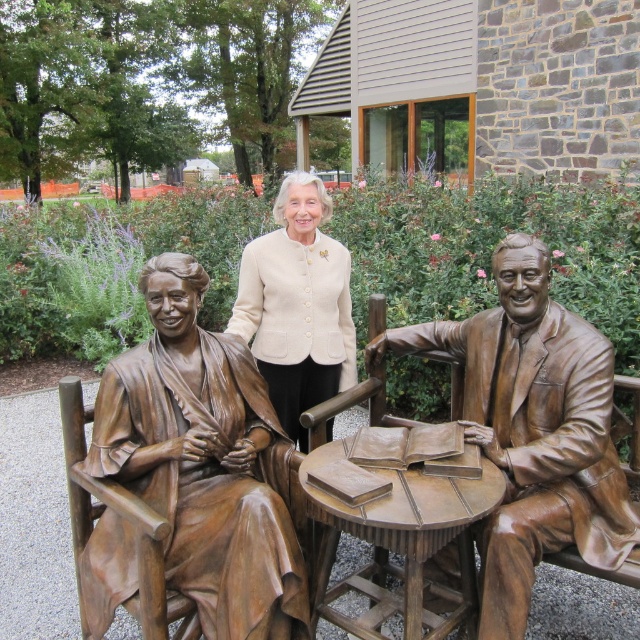
Question: Is bronze statue of couple at center behind bronze textured table at center?

Choices:
 (A) no
 (B) yes

Answer: (B)

Question: Can you confirm if bronze statue at left is positioned to the left of bronze statue of couple at center?

Choices:
 (A) no
 (B) yes

Answer: (B)

Question: Which point is closer to the camera taking this photo?

Choices:
 (A) (244, 284)
 (B) (544, 484)
 (C) (148, 410)

Answer: (B)

Question: Among these objects, which one is farthest from the camera?

Choices:
 (A) bronze textured table at center
 (B) bronze statue of couple at center
 (C) beige woolen jacket at center

Answer: (B)

Question: Is the position of bronze statue at left more distant than that of bronze textured table at center?

Choices:
 (A) yes
 (B) no

Answer: (A)

Question: Estimate the real-world distances between objects in this image. Which object is closer to the bronze textured table at center?

Choices:
 (A) bronze statue at right
 (B) bronze statue at left
 (C) beige woolen jacket at center
 (D) bronze statue of couple at center

Answer: (A)